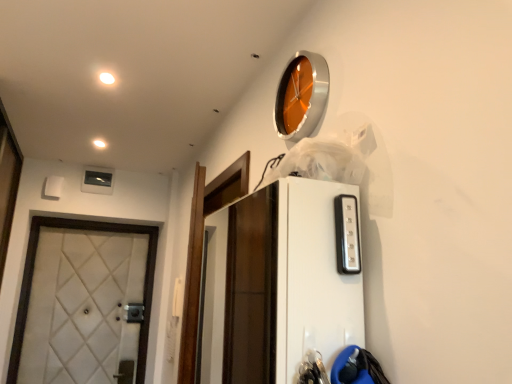
Question: Is orange metallic clock at upper center facing away from white glossy light at upper left, marked as the first light in a top-to-bottom arrangement?

Choices:
 (A) no
 (B) yes

Answer: (A)

Question: Is white glossy light at upper left, placed as the 2th light when sorted from back to front, surrounded by orange metallic clock at upper center?

Choices:
 (A) no
 (B) yes

Answer: (A)

Question: Are orange metallic clock at upper center and white glossy light at upper left, which is the second light from bottom to top, located far from each other?

Choices:
 (A) no
 (B) yes

Answer: (A)

Question: From the image's perspective, is orange metallic clock at upper center under white glossy light at upper left, marked as the first light in a top-to-bottom arrangement?

Choices:
 (A) no
 (B) yes

Answer: (B)

Question: From a real-world perspective, is orange metallic clock at upper center located beneath white glossy light at upper left, the 2th light when ordered from left to right?

Choices:
 (A) no
 (B) yes

Answer: (B)

Question: Is white quilted fabric door at left taller or shorter than orange metallic clock at upper center?

Choices:
 (A) short
 (B) tall

Answer: (B)

Question: Based on their sizes in the image, would you say white quilted fabric door at left is bigger or smaller than orange metallic clock at upper center?

Choices:
 (A) big
 (B) small

Answer: (A)

Question: In terms of width, does white quilted fabric door at left look wider or thinner when compared to orange metallic clock at upper center?

Choices:
 (A) thin
 (B) wide

Answer: (B)

Question: Is white quilted fabric door at left spatially inside orange metallic clock at upper center, or outside of it?

Choices:
 (A) outside
 (B) inside

Answer: (A)

Question: Choose the correct answer: Is orange metallic clock at upper center inside white quilted fabric door at left or outside it?

Choices:
 (A) inside
 (B) outside

Answer: (B)

Question: Is orange metallic clock at upper center bigger or smaller than white quilted fabric door at left?

Choices:
 (A) big
 (B) small

Answer: (B)

Question: Is orange metallic clock at upper center taller or shorter than white quilted fabric door at left?

Choices:
 (A) tall
 (B) short

Answer: (B)

Question: From a real-world perspective, relative to white quilted fabric door at left, is orange metallic clock at upper center vertically above or below?

Choices:
 (A) above
 (B) below

Answer: (A)

Question: From the image's perspective, is white quilted fabric door at left located above or below white glossy light at upper left, the 2th light when ordered from left to right?

Choices:
 (A) above
 (B) below

Answer: (B)

Question: Considering the relative positions of white quilted fabric door at left and white glossy light at upper left, the first light from the right, in the image provided, is white quilted fabric door at left to the left or to the right of white glossy light at upper left, the first light from the right,?

Choices:
 (A) left
 (B) right

Answer: (A)